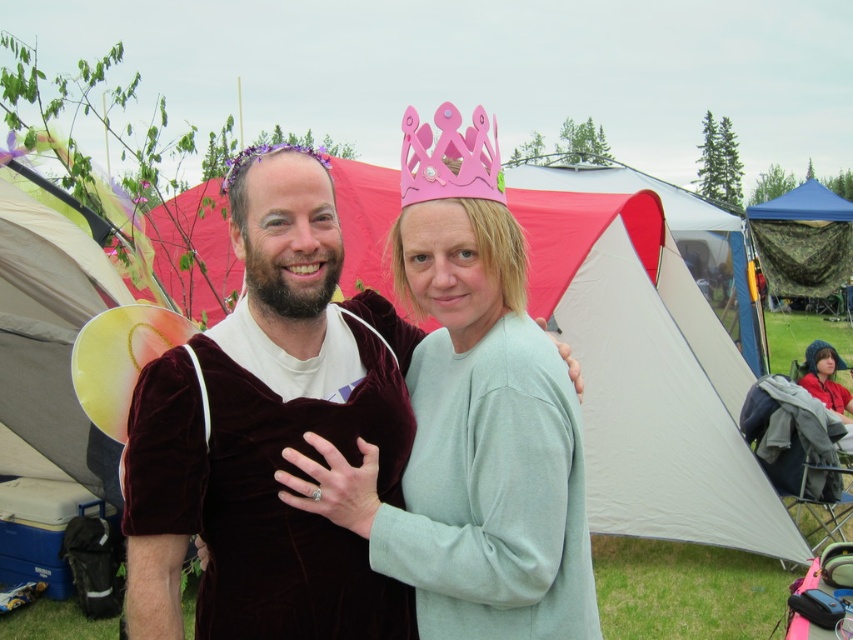
Question: Among these points, which one is nearest to the camera?

Choices:
 (A) (236, 368)
 (B) (448, 104)

Answer: (A)

Question: Where is velvet dress at center located in relation to camouflage netting at right in the image?

Choices:
 (A) right
 (B) left

Answer: (B)

Question: Estimate the real-world distances between objects in this image. Which object is closer to the light blue fabric hat at lower right?

Choices:
 (A) pink paper crown at upper center
 (B) velvet dress at center
 (C) camouflage netting at right

Answer: (B)

Question: Is velvet maroon cape at center behind camouflage netting at right?

Choices:
 (A) no
 (B) yes

Answer: (A)

Question: Among these objects, which one is nearest to the camera?

Choices:
 (A) velvet dress at center
 (B) pink paper crown at upper center
 (C) velvet maroon cape at center
 (D) camouflage netting at right

Answer: (C)

Question: Is camouflage netting at right to the right of light blue fabric hat at lower right from the viewer's perspective?

Choices:
 (A) yes
 (B) no

Answer: (A)